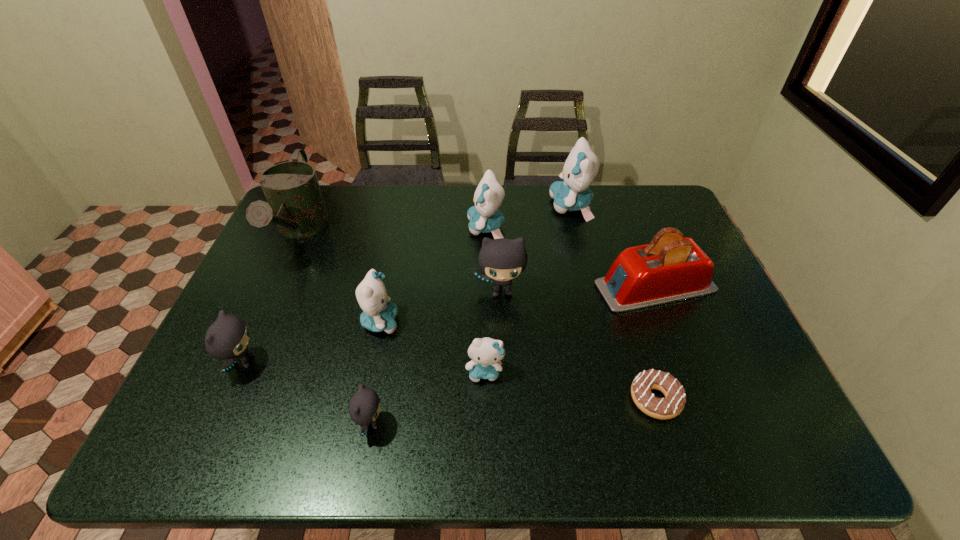
Locate an element on the screen. The width and height of the screenshot is (960, 540). vacant position in the image that satisfies the following two spatial constraints: 1. on the front-facing side of the rightmost gray kitten; 2. on the front-facing side of the nearest kitten is located at coordinates (508, 423).

I want to click on free space that satisfies the following two spatial constraints: 1. on the face of the doughnut; 2. on the right side of the tallest kitten, so click(x=618, y=399).

Locate an element on the screen. This screenshot has width=960, height=540. free spot that satisfies the following two spatial constraints: 1. on the front-facing side of the leftmost gray kitten; 2. on the left side of the chocolate doughnut is located at coordinates (227, 399).